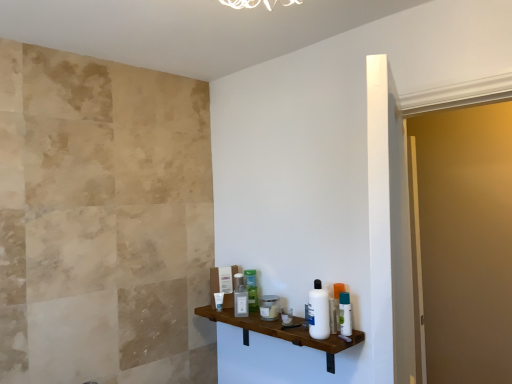
Image resolution: width=512 pixels, height=384 pixels. What do you see at coordinates (283, 332) in the screenshot?
I see `brown wooden shelf at center` at bounding box center [283, 332].

What do you see at coordinates (251, 289) in the screenshot? I see `green plastic bottle at center, marked as the 6th toiletry in a front-to-back arrangement` at bounding box center [251, 289].

Measure the distance between white glossy tube at center, the seventh toiletry positioned from the right, and camera.

white glossy tube at center, the seventh toiletry positioned from the right, is 7.21 feet away from camera.

Image resolution: width=512 pixels, height=384 pixels. What do you see at coordinates (318, 312) in the screenshot?
I see `white plastic bottle at shelf, the first toiletry viewed from the front` at bounding box center [318, 312].

Where is `white plastic bottle at right, placed as the first toiletry when sorted from right to left`? This screenshot has height=384, width=512. white plastic bottle at right, placed as the first toiletry when sorted from right to left is located at coordinates (345, 314).

Where is `white glossy lotion at center, positioned as the sixth toiletry in right-to-left order`? white glossy lotion at center, positioned as the sixth toiletry in right-to-left order is located at coordinates (240, 297).

In the scene shown: In terms of height, does white glossy lotion at center, positioned as the sixth toiletry in right-to-left order, look taller or shorter compared to clear plastic cup at center, positioned as the fifth toiletry in back-to-front order?

Considering their sizes, white glossy lotion at center, positioned as the sixth toiletry in right-to-left order, has more height than clear plastic cup at center, positioned as the fifth toiletry in back-to-front order.

Is white glossy lotion at center, the 3th toiletry in the back-to-front sequence, far away from clear plastic cup at center, placed as the third toiletry when sorted from front to back?

No, white glossy lotion at center, the 3th toiletry in the back-to-front sequence, is not far from clear plastic cup at center, placed as the third toiletry when sorted from front to back.

From a real-world perspective, between white glossy lotion at center, the 2th toiletry when ordered from left to right, and clear plastic cup at center, which is the 3th toiletry from right to left, who is vertically higher?

From a 3D spatial view, white glossy lotion at center, the 2th toiletry when ordered from left to right, is above.

From their relative heights in the image, would you say white glossy lotion at center, the 2th toiletry when ordered from left to right, is taller or shorter than green plastic bottle at center, the fifth toiletry in the right-to-left sequence?

Considering their sizes, white glossy lotion at center, the 2th toiletry when ordered from left to right, has less height than green plastic bottle at center, the fifth toiletry in the right-to-left sequence.

Considering the relative sizes of white glossy lotion at center, positioned as the sixth toiletry in right-to-left order, and green plastic bottle at center, acting as the second toiletry starting from the back, in the image provided, is white glossy lotion at center, positioned as the sixth toiletry in right-to-left order, smaller than green plastic bottle at center, acting as the second toiletry starting from the back,?

Yes, white glossy lotion at center, positioned as the sixth toiletry in right-to-left order, is smaller than green plastic bottle at center, acting as the second toiletry starting from the back.

In the scene shown: From a real-world perspective, which is physically below, white glossy lotion at center, the 3th toiletry in the back-to-front sequence, or green plastic bottle at center, the third toiletry from the left?

white glossy lotion at center, the 3th toiletry in the back-to-front sequence, is physically lower.

You are a GUI agent. You are given a task and a screenshot of the screen. Output one action in this format:
    pyautogui.click(x=<x>, y=<y>)
    Task: Click on the 1st toiletry to the left when counting from the matte glass jar at center, placed as the 4th toiletry when sorted from front to back
    
    Given the screenshot: What is the action you would take?
    pyautogui.click(x=251, y=289)

From a real-world perspective, is matte glass jar at center, the 4th toiletry when ordered from back to front, physically located above or below green plastic bottle at center, marked as the 6th toiletry in a front-to-back arrangement?

matte glass jar at center, the 4th toiletry when ordered from back to front, is below green plastic bottle at center, marked as the 6th toiletry in a front-to-back arrangement.

Can green plastic bottle at center, the fifth toiletry in the right-to-left sequence, be found inside matte glass jar at center, which is counted as the fourth toiletry, starting from the left?

Actually, green plastic bottle at center, the fifth toiletry in the right-to-left sequence, is outside matte glass jar at center, which is counted as the fourth toiletry, starting from the left.

Can we say white plastic bottle at right, the 2th toiletry in the front-to-back sequence, lies outside white plastic bottle at shelf, the second toiletry in the right-to-left sequence?

white plastic bottle at right, the 2th toiletry in the front-to-back sequence, is positioned outside white plastic bottle at shelf, the second toiletry in the right-to-left sequence.

From the image's perspective, is white plastic bottle at right, the 7th toiletry positioned from the left, below white plastic bottle at shelf, the second toiletry in the right-to-left sequence?

Yes.

Considering the sizes of objects white plastic bottle at right, which is the 6th toiletry from back to front, and white plastic bottle at shelf, which appears as the seventh toiletry when viewed from the back, in the image provided, who is bigger, white plastic bottle at right, which is the 6th toiletry from back to front, or white plastic bottle at shelf, which appears as the seventh toiletry when viewed from the back,?

With larger size is white plastic bottle at shelf, which appears as the seventh toiletry when viewed from the back.

In terms of width, does clear plastic cup at center, positioned as the fifth toiletry in back-to-front order, look wider or thinner when compared to white glossy lotion at center, the 3th toiletry in the back-to-front sequence?

Considering their sizes, clear plastic cup at center, positioned as the fifth toiletry in back-to-front order, looks slimmer than white glossy lotion at center, the 3th toiletry in the back-to-front sequence.

Which of these two, clear plastic cup at center, which is the 3th toiletry from right to left, or white glossy lotion at center, the 3th toiletry in the back-to-front sequence, is smaller?

Smaller between the two is clear plastic cup at center, which is the 3th toiletry from right to left.

From the image's perspective, is clear plastic cup at center, positioned as the 5th toiletry in left-to-right order, positioned above or below white glossy lotion at center, positioned as the sixth toiletry in right-to-left order?

Based on their image positions, clear plastic cup at center, positioned as the 5th toiletry in left-to-right order, is located beneath white glossy lotion at center, positioned as the sixth toiletry in right-to-left order.

Would you consider white glossy tube at center, which is counted as the first toiletry, starting from the back, to be distant from white plastic bottle at shelf, the first toiletry viewed from the front?

That's not correct — white glossy tube at center, which is counted as the first toiletry, starting from the back, is a little close to white plastic bottle at shelf, the first toiletry viewed from the front.

Is white glossy tube at center, the 1th toiletry in the left-to-right sequence, positioned beyond the bounds of white plastic bottle at shelf, the 6th toiletry when ordered from left to right?

Yes, white glossy tube at center, the 1th toiletry in the left-to-right sequence, is outside of white plastic bottle at shelf, the 6th toiletry when ordered from left to right.

Is point (217, 303) positioned behind point (325, 317)?

Yes, point (217, 303) is farther from viewer.

Could you tell me if white glossy tube at center, the seventh toiletry positioned from the right, is turned towards white plastic bottle at shelf, the second toiletry in the right-to-left sequence?

No, white glossy tube at center, the seventh toiletry positioned from the right, is not turned towards white plastic bottle at shelf, the second toiletry in the right-to-left sequence.

Between point (268, 325) and point (328, 326), which one is positioned behind?

The point (268, 325) is farther from the camera.

From a real-world perspective, is brown wooden shelf at center below white plastic bottle at shelf, the first toiletry viewed from the front?

Correct, in the physical world, brown wooden shelf at center is lower than white plastic bottle at shelf, the first toiletry viewed from the front.

Does brown wooden shelf at center appear on the right side of white plastic bottle at shelf, the second toiletry in the right-to-left sequence?

In fact, brown wooden shelf at center is to the left of white plastic bottle at shelf, the second toiletry in the right-to-left sequence.

There is a clear plastic cup at center, positioned as the 5th toiletry in left-to-right order. What are the coordinates of `the 3rd toiletry above it (from the image's perspective)` in the screenshot? It's located at (240, 297).

The height and width of the screenshot is (384, 512). I want to click on the 1st toiletry behind when counting from the white glossy lotion at center, the 3th toiletry in the back-to-front sequence, so click(x=251, y=289).

Estimate the real-world distances between objects in this image. Which object is closer to matte glass jar at center, which is counted as the fourth toiletry, starting from the left, green plastic bottle at center, the fifth toiletry in the right-to-left sequence, or white plastic bottle at shelf, the 6th toiletry when ordered from left to right?

Based on the image, green plastic bottle at center, the fifth toiletry in the right-to-left sequence, appears to be nearer to matte glass jar at center, which is counted as the fourth toiletry, starting from the left.

Which object lies nearer to the anchor point matte glass jar at center, which is counted as the fourth toiletry, starting from the left, white glossy lotion at center, the 2th toiletry when ordered from left to right, or brown wooden shelf at center?

white glossy lotion at center, the 2th toiletry when ordered from left to right, lies closer to matte glass jar at center, which is counted as the fourth toiletry, starting from the left, than the other object.

Based on their spatial positions, is white glossy lotion at center, which appears as the fifth toiletry when viewed from the front, or clear plastic cup at center, positioned as the 5th toiletry in left-to-right order, further from white plastic bottle at right, placed as the first toiletry when sorted from right to left?

white glossy lotion at center, which appears as the fifth toiletry when viewed from the front, lies further to white plastic bottle at right, placed as the first toiletry when sorted from right to left, than the other object.

Looking at the image, which one is located further to brown wooden shelf at center, green plastic bottle at center, the fifth toiletry in the right-to-left sequence, or clear plastic cup at center, placed as the third toiletry when sorted from front to back?

green plastic bottle at center, the fifth toiletry in the right-to-left sequence, is positioned further to the anchor brown wooden shelf at center.

When comparing their distances from white plastic bottle at right, the 2th toiletry in the front-to-back sequence, does brown wooden shelf at center or white plastic bottle at shelf, the first toiletry viewed from the front, seem closer?

white plastic bottle at shelf, the first toiletry viewed from the front.

Estimate the real-world distances between objects in this image. Which object is further from matte glass jar at center, which is counted as the fourth toiletry, starting from the left, white glossy lotion at center, the 2th toiletry when ordered from left to right, or white glossy tube at center, the seventh toiletry positioned from the right?

Among the two, white glossy tube at center, the seventh toiletry positioned from the right, is located further to matte glass jar at center, which is counted as the fourth toiletry, starting from the left.

When comparing their distances from white plastic bottle at right, placed as the first toiletry when sorted from right to left, does white glossy lotion at center, the 3th toiletry in the back-to-front sequence, or green plastic bottle at center, acting as the second toiletry starting from the back, seem closer?

green plastic bottle at center, acting as the second toiletry starting from the back, is positioned closer to the anchor white plastic bottle at right, placed as the first toiletry when sorted from right to left.

Consider the image. Which object lies nearer to the anchor point matte glass jar at center, the 4th toiletry when ordered from back to front, white plastic bottle at shelf, the first toiletry viewed from the front, or brown wooden shelf at center?

The object closer to matte glass jar at center, the 4th toiletry when ordered from back to front, is brown wooden shelf at center.

Image resolution: width=512 pixels, height=384 pixels. In order to click on toiletry located between white glossy tube at center, the seventh toiletry positioned from the right, and green plastic bottle at center, acting as the second toiletry starting from the back, in the left-right direction in this screenshot , I will do `click(240, 297)`.

Find the location of a particular element. This screenshot has width=512, height=384. toiletry between matte glass jar at center, placed as the 4th toiletry when sorted from front to back, and green plastic bottle at center, marked as the 6th toiletry in a front-to-back arrangement, along the z-axis is located at coordinates (240, 297).

Identify the location of shelf located between white glossy lotion at center, the 2th toiletry when ordered from left to right, and white plastic bottle at right, which is the 6th toiletry from back to front, in the left-right direction. The image size is (512, 384). (283, 332).

You are a GUI agent. You are given a task and a screenshot of the screen. Output one action in this format:
    pyautogui.click(x=<x>, y=<y>)
    Task: Click on the toiletry between clear plastic cup at center, positioned as the 5th toiletry in left-to-right order, and white plastic bottle at right, the 7th toiletry positioned from the left
    Image resolution: width=512 pixels, height=384 pixels.
    Given the screenshot: What is the action you would take?
    pyautogui.click(x=318, y=312)